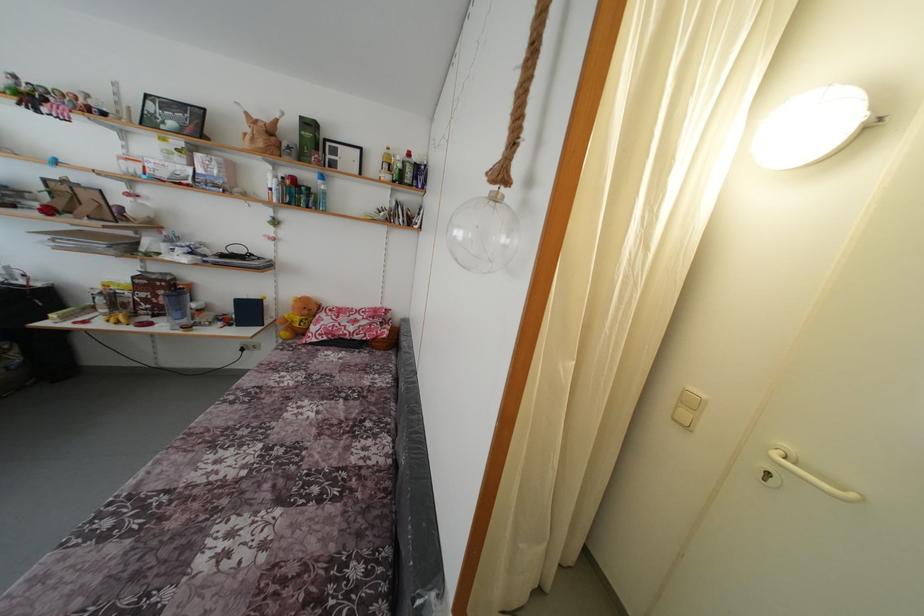
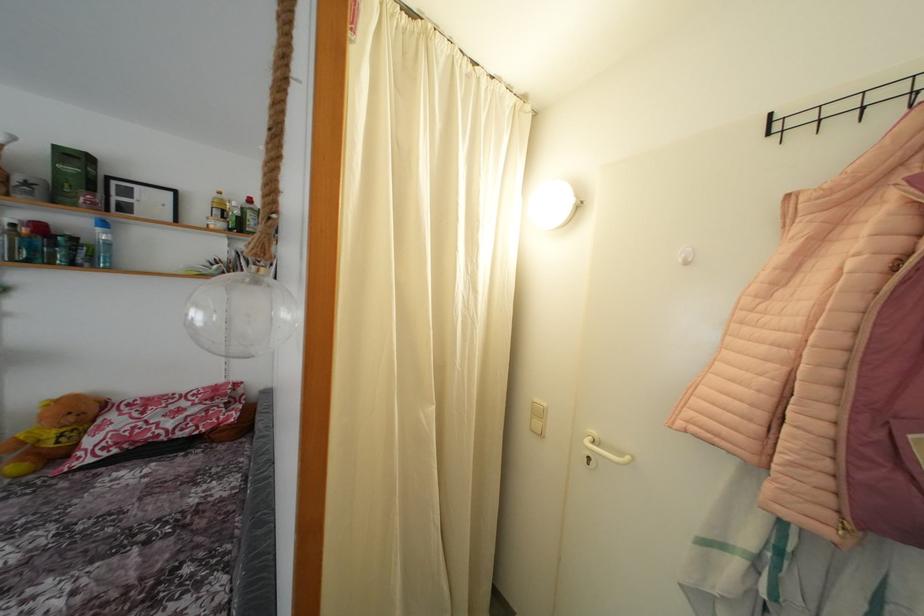
Where in the second image is the point corresponding to (696,394) from the first image?

(541, 406)